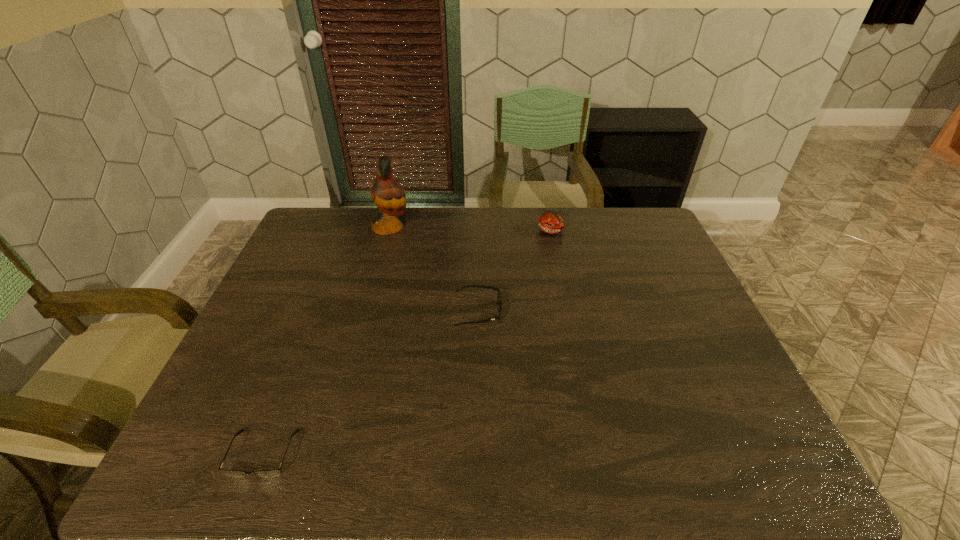
The height and width of the screenshot is (540, 960). I want to click on free space located 0.380m on the front-facing side of the third farthest object, so click(x=638, y=311).

I want to click on parrot at the far edge, so click(x=387, y=194).

Find the location of a particular element. This screenshot has height=540, width=960. tomato that is at the far edge is located at coordinates (551, 222).

You are a GUI agent. You are given a task and a screenshot of the screen. Output one action in this format:
    pyautogui.click(x=<x>, y=<y>)
    Task: Click on the object present at the near edge
    This screenshot has width=960, height=540.
    Given the screenshot: What is the action you would take?
    pyautogui.click(x=275, y=472)

The image size is (960, 540). Identify the location of object present at the left edge. (275, 472).

The height and width of the screenshot is (540, 960). I want to click on object located in the near left corner section of the desktop, so click(275, 472).

This screenshot has height=540, width=960. I want to click on vacant space at the far edge of the desktop, so click(x=489, y=242).

Where is `vacant space at the near edge of the desktop`? vacant space at the near edge of the desktop is located at coordinates (619, 458).

You are a GUI agent. You are given a task and a screenshot of the screen. Output one action in this format:
    pyautogui.click(x=<x>, y=<y>)
    Task: Click on the free space at the left edge of the desktop
    The image size is (960, 540).
    Given the screenshot: What is the action you would take?
    [304, 276]

Identify the location of free location at the far left corner. Image resolution: width=960 pixels, height=540 pixels. (332, 207).